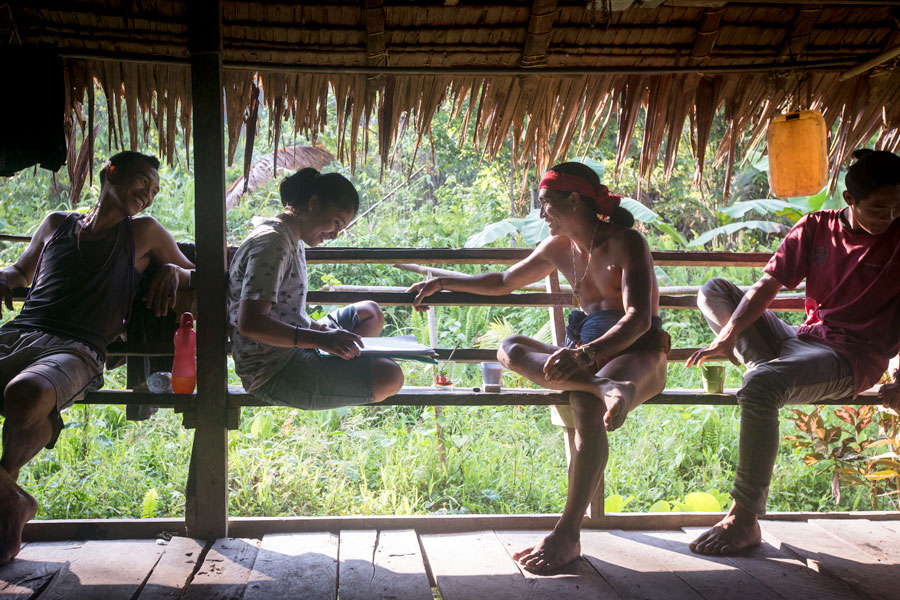
This screenshot has width=900, height=600. Find the location of `hood`. hood is located at coordinates (481, 69).